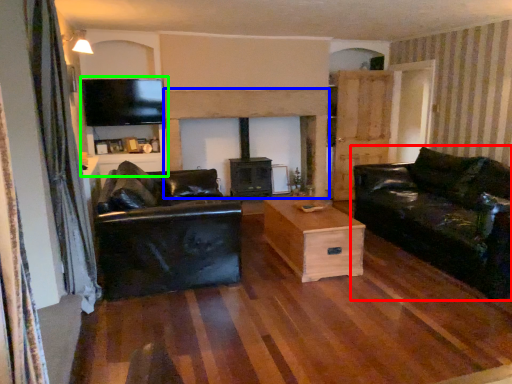
Question: Which object is positioned closest to studio couch (highlighted by a red box)? Select from fireplace (highlighted by a blue box) and entertainment center (highlighted by a green box).

Choices:
 (A) fireplace
 (B) entertainment center

Answer: (A)